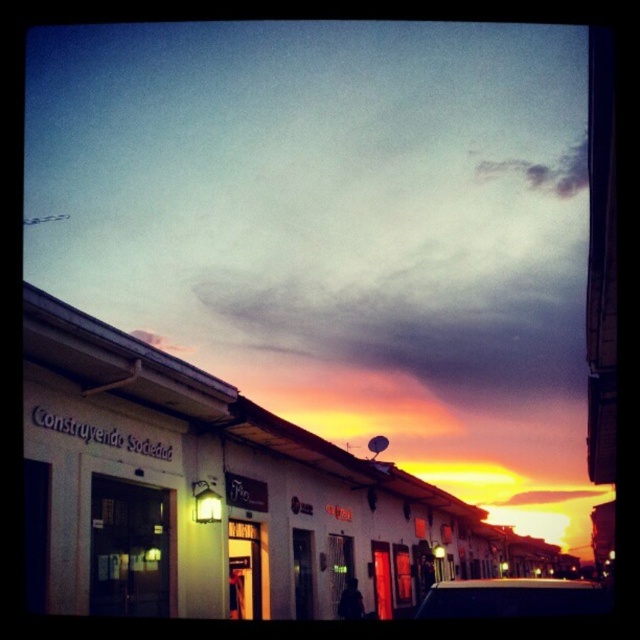
Question: Among these points, which one is nearest to the camera?

Choices:
 (A) (289, 157)
 (B) (467, 586)

Answer: (B)

Question: Which object is closer to the camera taking this photo?

Choices:
 (A) white glossy car at lower center
 (B) cloudy sky at upper center

Answer: (A)

Question: Is cloudy sky at upper center positioned before white glossy car at lower center?

Choices:
 (A) no
 (B) yes

Answer: (A)

Question: Is cloudy sky at upper center wider than white glossy car at lower center?

Choices:
 (A) no
 (B) yes

Answer: (B)

Question: Is cloudy sky at upper center closer to camera compared to white glossy car at lower center?

Choices:
 (A) yes
 (B) no

Answer: (B)